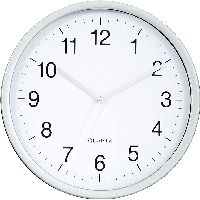
You are a GUI agent. You are given a task and a screenshot of the screen. Output one action in this format:
    pyautogui.click(x=<x>, y=<y>)
    Task: Click on the clock face
    The width and height of the screenshot is (200, 200).
    Given the screenshot: What is the action you would take?
    pyautogui.click(x=124, y=115)